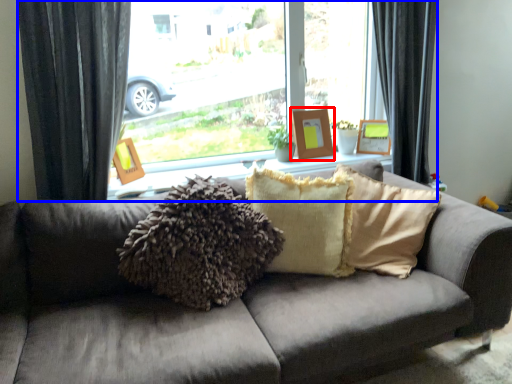
Question: Which point is further to the camera, picture frame (highlighted by a red box) or window (highlighted by a blue box)?

Choices:
 (A) picture frame
 (B) window

Answer: (A)